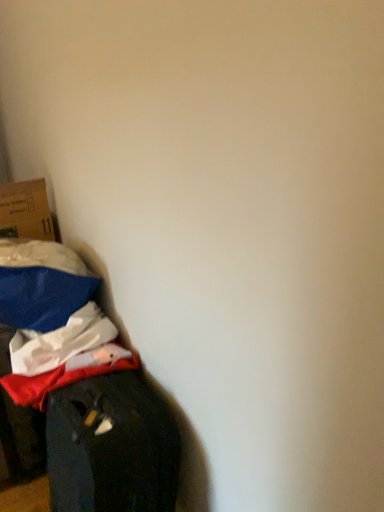
Measure the distance between cardboard box at left and camera.

They are 1.92 meters apart.

At what (x,y) coordinates should I click in order to perform the action: click on cardboard box at left. Please return your answer as a coordinate pair (x, y). Looking at the image, I should click on (25, 211).

What do you see at coordinates (25, 211) in the screenshot?
I see `cardboard box at left` at bounding box center [25, 211].

Locate an element on the screen. The height and width of the screenshot is (512, 384). velvet-like fabric couch at lower left is located at coordinates (82, 387).

What do you see at coordinates (82, 387) in the screenshot? The height and width of the screenshot is (512, 384). I see `velvet-like fabric couch at lower left` at bounding box center [82, 387].

The height and width of the screenshot is (512, 384). Find the location of `cardboard box at left`. cardboard box at left is located at coordinates (25, 211).

Between velvet-like fabric couch at lower left and cardboard box at left, which one appears on the left side from the viewer's perspective?

From the viewer's perspective, cardboard box at left appears more on the left side.

Considering the relative positions of velvet-like fabric couch at lower left and cardboard box at left in the image provided, is velvet-like fabric couch at lower left in front of cardboard box at left?

Yes, velvet-like fabric couch at lower left is closer to the camera.

Is point (129, 509) more distant than point (46, 224)?

No, it is in front of (46, 224).

From the image's perspective, is velvet-like fabric couch at lower left on cardboard box at left?

No, from the image's perspective, velvet-like fabric couch at lower left is not above cardboard box at left.

From a real-world perspective, is velvet-like fabric couch at lower left positioned over cardboard box at left based on gravity?

No, from a real-world perspective, velvet-like fabric couch at lower left is not over cardboard box at left

In terms of width, does velvet-like fabric couch at lower left look wider or thinner when compared to cardboard box at left?

In the image, velvet-like fabric couch at lower left appears to be wider than cardboard box at left.

Is velvet-like fabric couch at lower left taller or shorter than cardboard box at left?

Clearly, velvet-like fabric couch at lower left is taller compared to cardboard box at left.

Which of these two, velvet-like fabric couch at lower left or cardboard box at left, is smaller?

cardboard box at left is smaller.

Is velvet-like fabric couch at lower left completely or partially outside of cardboard box at left?

That's correct, velvet-like fabric couch at lower left is outside of cardboard box at left.

Based on the photo, is velvet-like fabric couch at lower left touching cardboard box at left?

No, velvet-like fabric couch at lower left is not with cardboard box at left.

Could you tell me if velvet-like fabric couch at lower left is turned towards cardboard box at left?

No, velvet-like fabric couch at lower left is not oriented towards cardboard box at left.

Consider the image. How different are the orientations of velvet-like fabric couch at lower left and cardboard box at left in degrees?

The facing directions of velvet-like fabric couch at lower left and cardboard box at left are 0.322 degrees apart.

Measure the distance from velvet-like fabric couch at lower left to cardboard box at left.

The distance of velvet-like fabric couch at lower left from cardboard box at left is 27.29 inches.

The image size is (384, 512). Find the location of `box that appears behind the velvet-like fabric couch at lower left`. box that appears behind the velvet-like fabric couch at lower left is located at coordinates (25, 211).

Can you confirm if cardboard box at left is positioned to the left of velvet-like fabric couch at lower left?

Yes, cardboard box at left is to the left of velvet-like fabric couch at lower left.

Is cardboard box at left closer to the viewer compared to velvet-like fabric couch at lower left?

No.

Is point (20, 223) closer or farther from the camera than point (122, 381)?

Point (20, 223).

From the image's perspective, who appears lower, cardboard box at left or velvet-like fabric couch at lower left?

velvet-like fabric couch at lower left appears lower in the image.

In the scene shown: From a real-world perspective, is cardboard box at left on top of velvet-like fabric couch at lower left?

Yes, from a real-world perspective, cardboard box at left is above velvet-like fabric couch at lower left.

Which of these two, cardboard box at left or velvet-like fabric couch at lower left, is wider?

With larger width is velvet-like fabric couch at lower left.

Considering the relative sizes of cardboard box at left and velvet-like fabric couch at lower left in the image provided, is cardboard box at left shorter than velvet-like fabric couch at lower left?

Yes.

Is cardboard box at left bigger or smaller than velvet-like fabric couch at lower left?

In the image, cardboard box at left appears to be smaller than velvet-like fabric couch at lower left.

Is cardboard box at left spatially inside velvet-like fabric couch at lower left, or outside of it?

cardboard box at left is spatially situated outside velvet-like fabric couch at lower left.

Is cardboard box at left directly adjacent to velvet-like fabric couch at lower left?

No, cardboard box at left is not making contact with velvet-like fabric couch at lower left.

From the picture: Is cardboard box at left oriented towards velvet-like fabric couch at lower left?

No, cardboard box at left is not aimed at velvet-like fabric couch at lower left.

This screenshot has width=384, height=512. In order to click on box behind the velvet-like fabric couch at lower left in this screenshot , I will do `click(25, 211)`.

At what (x,y) coordinates should I click in order to perform the action: click on furniture that is under the cardboard box at left (from a real-world perspective). Please return your answer as a coordinate pair (x, y). Looking at the image, I should click on (82, 387).

The image size is (384, 512). Identify the location of box behind the velvet-like fabric couch at lower left. (25, 211).